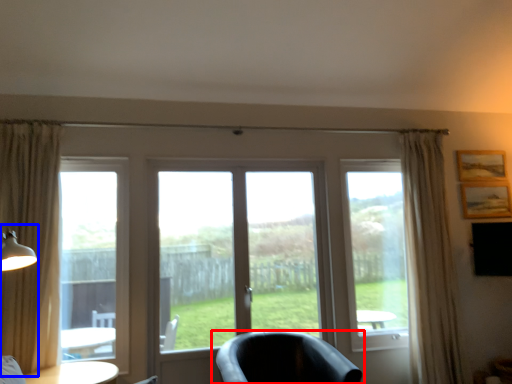
Question: Which object appears farthest to the camera in this image, chair (highlighted by a red box) or table lamp (highlighted by a blue box)?

Choices:
 (A) chair
 (B) table lamp

Answer: (A)